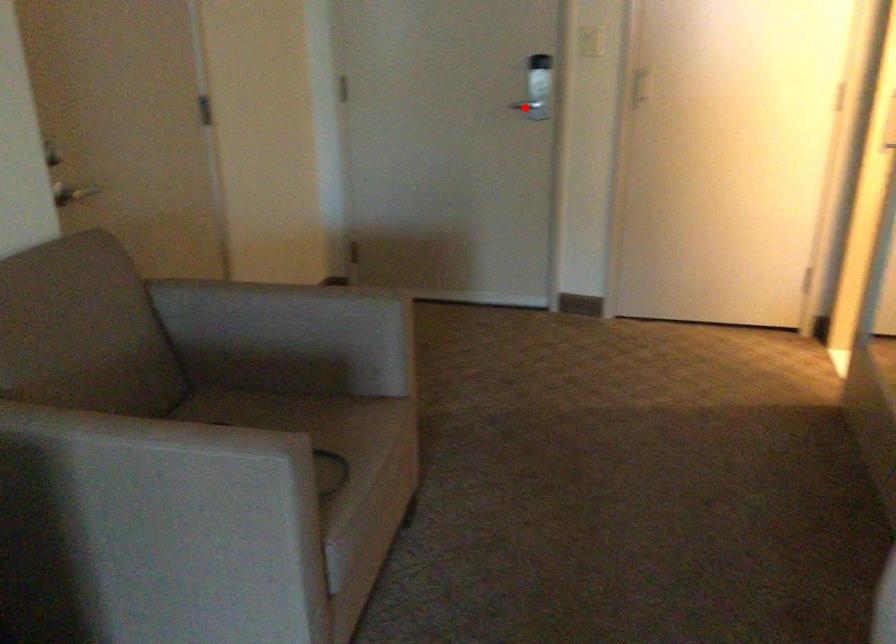
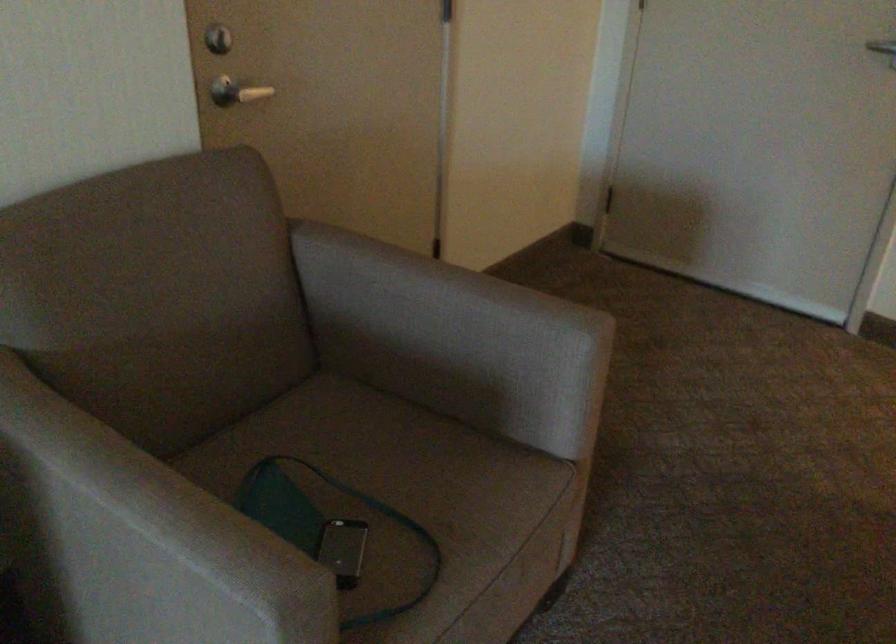
Question: I am providing you with two images of the same scene from different viewpoints. In image1, a red point is highlighted. Considering the same 3D point in image2, which of the following is correct?

Choices:
 (A) It is closer
 (B) It is farther

Answer: (A)